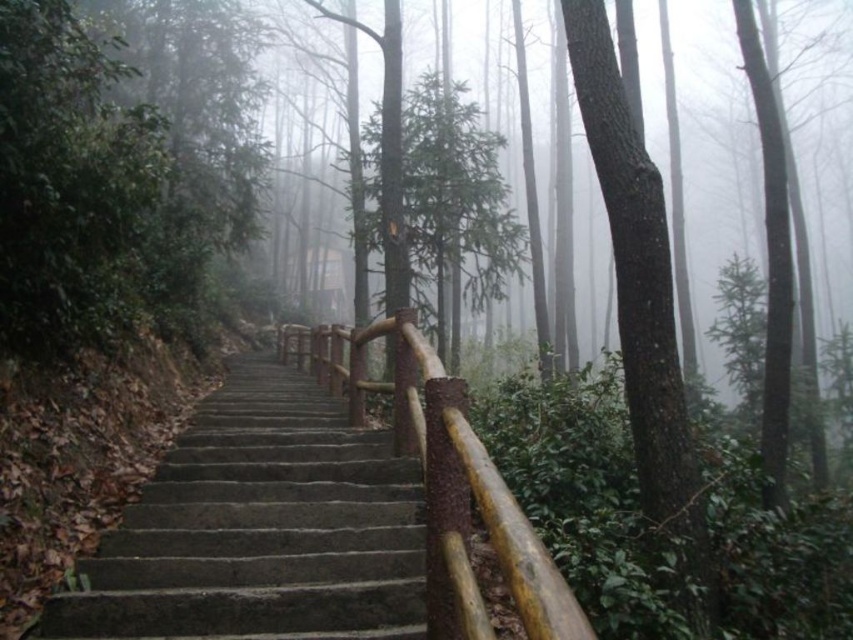
Is point (248, 426) positioned behind point (431, 596)?

Yes.

Between dark gray concrete stairs at center and brown wood/rustic rail at center, which one is positioned higher?

brown wood/rustic rail at center is higher up.

Who is more distant from viewer, [212,624] or [454,465]?

Point [212,624]

The width and height of the screenshot is (853, 640). I want to click on dark gray concrete stairs at center, so (260, 529).

Does point (648, 168) come farther from viewer compared to point (422, 122)?

No, (648, 168) is in front of (422, 122).

In the scene shown: Is smooth bark tree at center to the right of green matte tree at center from the viewer's perspective?

No, smooth bark tree at center is not to the right of green matte tree at center.

Who is more forward, (589, 12) or (474, 161)?

Point (589, 12) is more forward.

Locate an element on the screen. This screenshot has height=640, width=853. smooth bark tree at center is located at coordinates (643, 316).

Is brown wood/rustic rail at center positioned before green matte tree at center?

Yes, brown wood/rustic rail at center is in front of green matte tree at center.

Is point (305, 337) positioned before point (421, 228)?

No.

Who is more distant from viewer, (312, 340) or (521, 253)?

Positioned behind is point (521, 253).

In order to click on brown wood/rustic rail at center in this screenshot , I will do `click(447, 483)`.